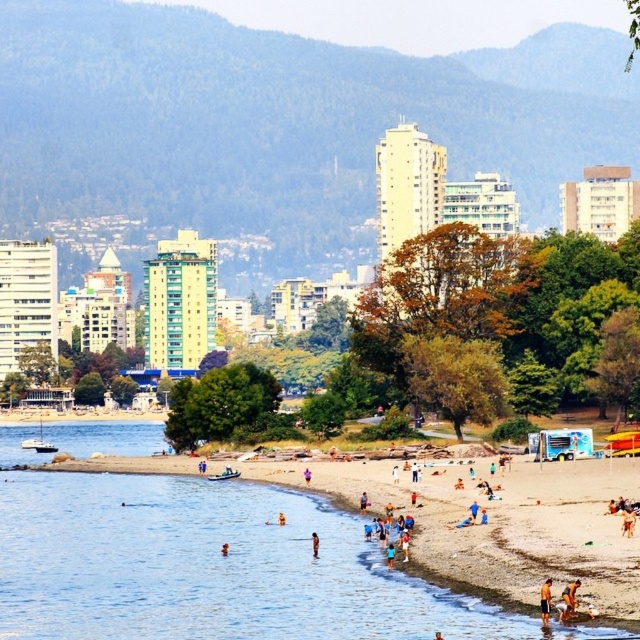
Question: Which point is farther to the camera?

Choices:
 (A) tan skin person at beach center
 (B) smooth sand beach at lower right

Answer: (A)

Question: Which object is the closest to the tan skin person at lower right?

Choices:
 (A) smooth sand beach at lower right
 (B) tan skin person at beach center

Answer: (B)

Question: Can you confirm if orange fabric shorts at lower right is thinner than tan skin person at beach center?

Choices:
 (A) yes
 (B) no

Answer: (B)

Question: Which of the following is the farthest from the observer?

Choices:
 (A) [545, 600]
 (B) [572, 598]
 (C) [314, 552]

Answer: (C)

Question: Can you confirm if smooth sand beach at lower right is bigger than orange fabric shorts at lower right?

Choices:
 (A) no
 (B) yes

Answer: (B)

Question: Where is smooth sand beach at lower right located in relation to orange fabric shorts at lower right in the image?

Choices:
 (A) right
 (B) left

Answer: (B)